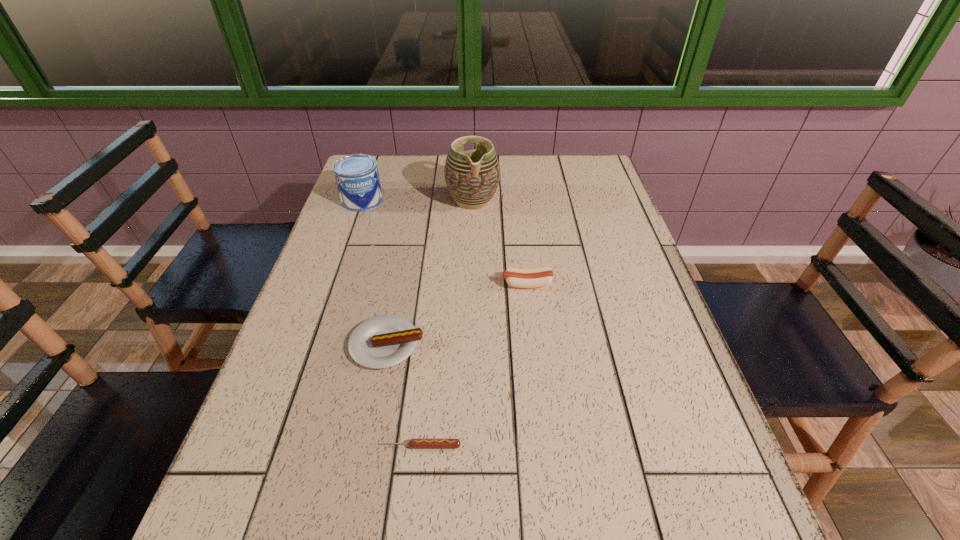
At what (x,y) coordinates should I click in order to perform the action: click on the tallest object. Please return your answer as a coordinate pair (x, y). Looking at the image, I should click on (472, 177).

Image resolution: width=960 pixels, height=540 pixels. I want to click on the fourth shortest object, so click(357, 177).

Image resolution: width=960 pixels, height=540 pixels. Identify the location of can. (357, 177).

At what (x,y) coordinates should I click in order to perform the action: click on the rightmost sausage. Please return your answer as a coordinate pair (x, y). The height and width of the screenshot is (540, 960). Looking at the image, I should click on (515, 277).

The image size is (960, 540). In order to click on the third farthest object in this screenshot , I will do `click(515, 277)`.

Find the location of a particular element. the second shortest object is located at coordinates (383, 341).

This screenshot has width=960, height=540. Find the location of `the second farthest sausage`. the second farthest sausage is located at coordinates (383, 341).

Locate an element on the screen. The height and width of the screenshot is (540, 960). the nearest object is located at coordinates (416, 443).

This screenshot has width=960, height=540. Find the location of `the shortest sausage`. the shortest sausage is located at coordinates (416, 443).

Where is `vacant space located on the back of the pottery`? The width and height of the screenshot is (960, 540). vacant space located on the back of the pottery is located at coordinates (473, 158).